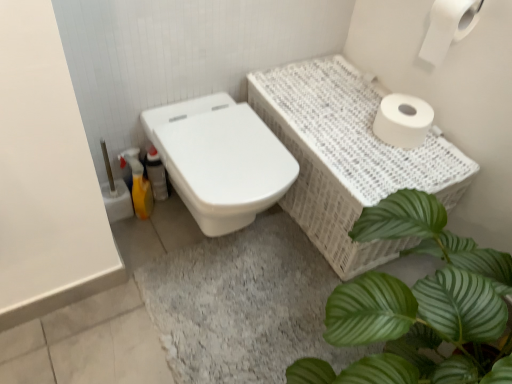
Locate an element on the screen. This screenshot has height=384, width=512. free space above white matte toilet paper at upper right, which appears as the first toilet paper when ordered from the bottom (from a real-world perspective) is located at coordinates (417, 109).